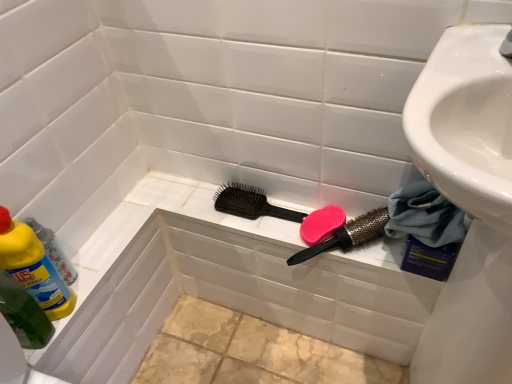
Question: Considering the relative sizes of pink matte comb at center and black plastic hairbrush at center, the first brush when ordered from left to right, in the image provided, is pink matte comb at center shorter than black plastic hairbrush at center, the first brush when ordered from left to right,?

Choices:
 (A) yes
 (B) no

Answer: (B)

Question: Can you confirm if pink matte comb at center is positioned to the left of black plastic hairbrush at center, which ranks as the second brush in right-to-left order?

Choices:
 (A) no
 (B) yes

Answer: (A)

Question: Are pink matte comb at center and black plastic hairbrush at center, the first brush when ordered from left to right, located far from each other?

Choices:
 (A) yes
 (B) no

Answer: (B)

Question: Considering the relative positions of pink matte comb at center and black plastic hairbrush at center, the first brush when ordered from left to right, in the image provided, is pink matte comb at center to the right of black plastic hairbrush at center, the first brush when ordered from left to right, from the viewer's perspective?

Choices:
 (A) no
 (B) yes

Answer: (B)

Question: Considering the relative positions of pink matte comb at center and black plastic hairbrush at center, which ranks as the second brush in right-to-left order, in the image provided, is pink matte comb at center in front of black plastic hairbrush at center, which ranks as the second brush in right-to-left order,?

Choices:
 (A) yes
 (B) no

Answer: (A)

Question: From their relative heights in the image, would you say pink matte comb at center is taller or shorter than black plastic hairbrush at center, the first brush when ordered from left to right?

Choices:
 (A) short
 (B) tall

Answer: (B)

Question: From the image's perspective, relative to black plastic hairbrush at center, the first brush when ordered from left to right, is pink matte comb at center above or below?

Choices:
 (A) below
 (B) above

Answer: (A)

Question: Relative to black plastic hairbrush at center, the first brush when ordered from left to right, is pink matte comb at center in front or behind?

Choices:
 (A) behind
 (B) front

Answer: (B)

Question: In terms of size, does pink matte comb at center appear bigger or smaller than black plastic hairbrush at center, the first brush when ordered from left to right?

Choices:
 (A) big
 (B) small

Answer: (B)

Question: From a real-world perspective, is pink matte comb at center positioned above or below blue fabric towel at lower right?

Choices:
 (A) below
 (B) above

Answer: (A)

Question: Is point (330, 208) positioned closer to the camera than point (406, 233)?

Choices:
 (A) farther
 (B) closer

Answer: (A)

Question: Is pink matte comb at center in front of or behind blue fabric towel at lower right in the image?

Choices:
 (A) front
 (B) behind

Answer: (B)

Question: From the image's perspective, is pink matte comb at center above or below blue fabric towel at lower right?

Choices:
 (A) below
 (B) above

Answer: (A)

Question: Is pink rubber brush at center, arranged as the 2th brush when viewed from the left, in front of or behind blue fabric towel at lower right in the image?

Choices:
 (A) behind
 (B) front

Answer: (A)

Question: Is point (306, 251) positioned closer to the camera than point (439, 236)?

Choices:
 (A) farther
 (B) closer

Answer: (A)